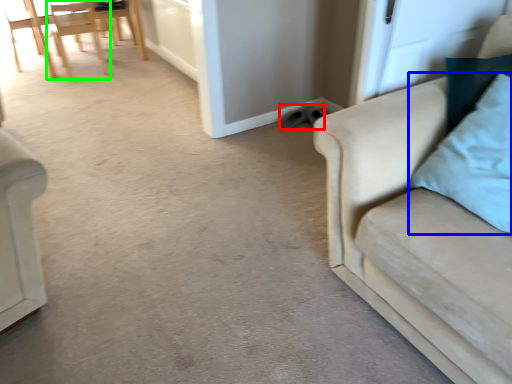
Question: Which object is the farthest from footwear (highlighted by a red box)? Choose among these: pillow (highlighted by a blue box) or chair (highlighted by a green box).

Choices:
 (A) pillow
 (B) chair

Answer: (B)